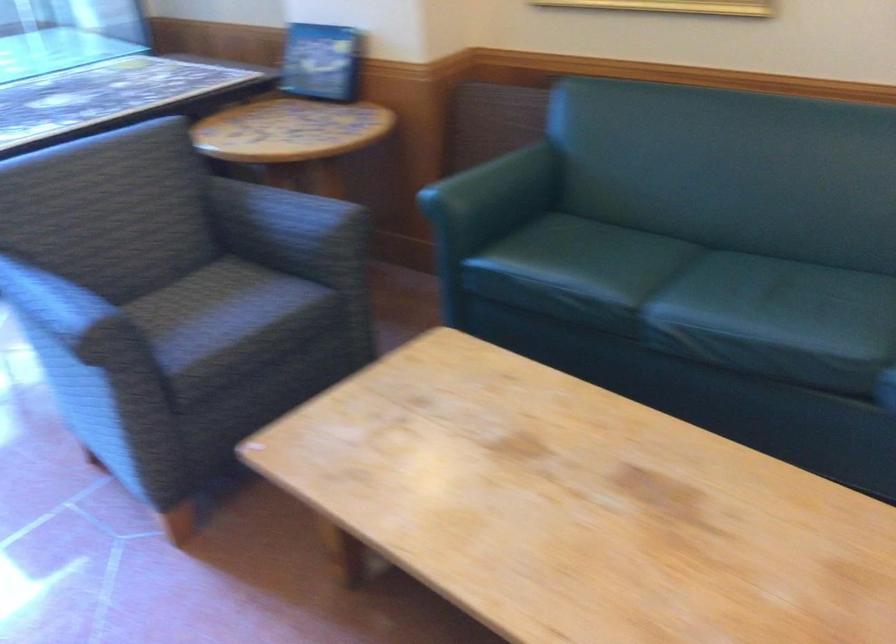
Where is `small blue book`? small blue book is located at coordinates (321, 62).